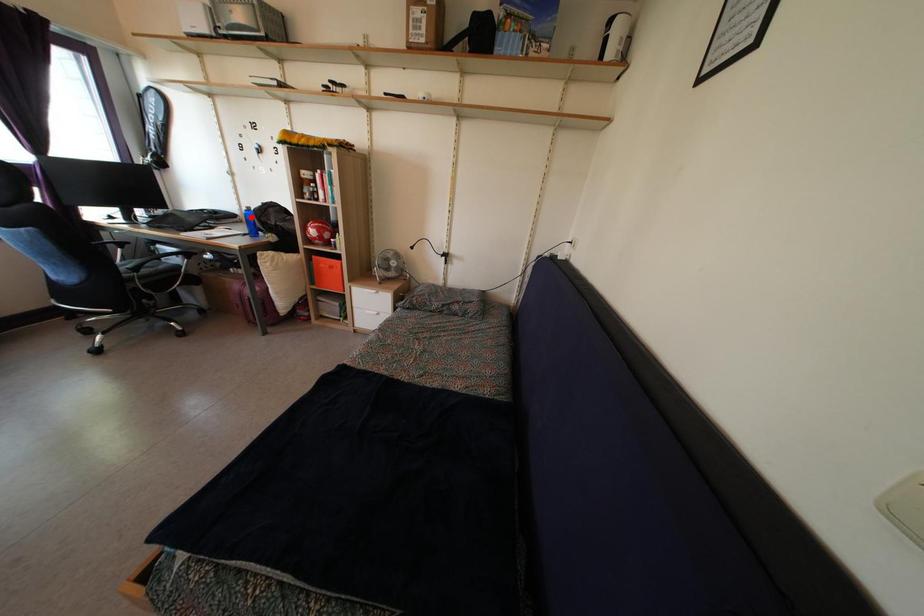
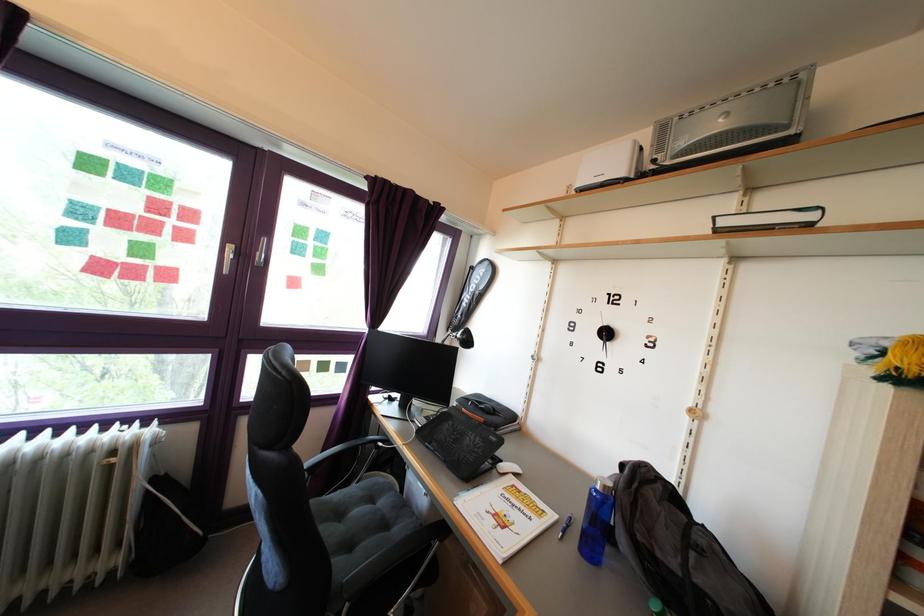
Where in the second image is the point corresponding to the highlighted location from the first image?

(609, 496)